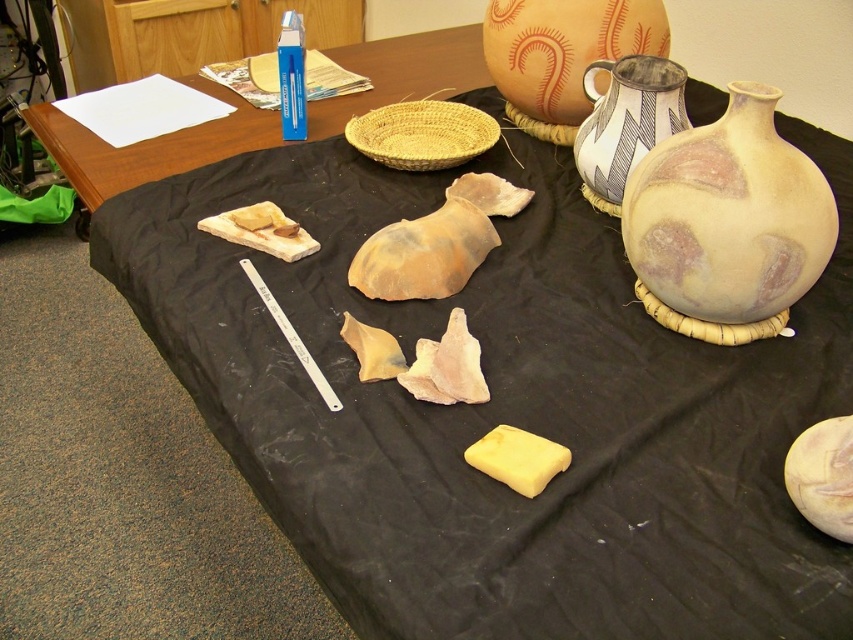
Which is more to the right, wooden table at upper left or speckled clay vase at upper right?

Positioned to the right is speckled clay vase at upper right.

Is wooden table at upper left shorter than speckled clay vase at upper right?

Incorrect, wooden table at upper left's height does not fall short of speckled clay vase at upper right's.

Is point (115, 179) positioned before point (595, 125)?

No, (115, 179) is further to viewer.

Image resolution: width=853 pixels, height=640 pixels. I want to click on wooden table at upper left, so (x=149, y=145).

Does matte clay vase at right have a greater height compared to speckled clay vase at upper right?

Indeed, matte clay vase at right has a greater height compared to speckled clay vase at upper right.

Between matte clay vase at right and speckled clay vase at upper right, which one appears on the left side from the viewer's perspective?

From the viewer's perspective, speckled clay vase at upper right appears more on the left side.

Image resolution: width=853 pixels, height=640 pixels. What do you see at coordinates (727, 224) in the screenshot?
I see `matte clay vase at right` at bounding box center [727, 224].

Find the location of `matte clay vase at right`. matte clay vase at right is located at coordinates (727, 224).

Does speckled clay vase at upper right appear under yellow rubber at center?

No, speckled clay vase at upper right is not below yellow rubber at center.

Does speckled clay vase at upper right have a lesser height compared to yellow rubber at center?

No.

From the picture: Measure the distance between point (664, 60) and camera.

Point (664, 60) and camera are 1.03 meters apart.

Identify the location of speckled clay vase at upper right. (625, 122).